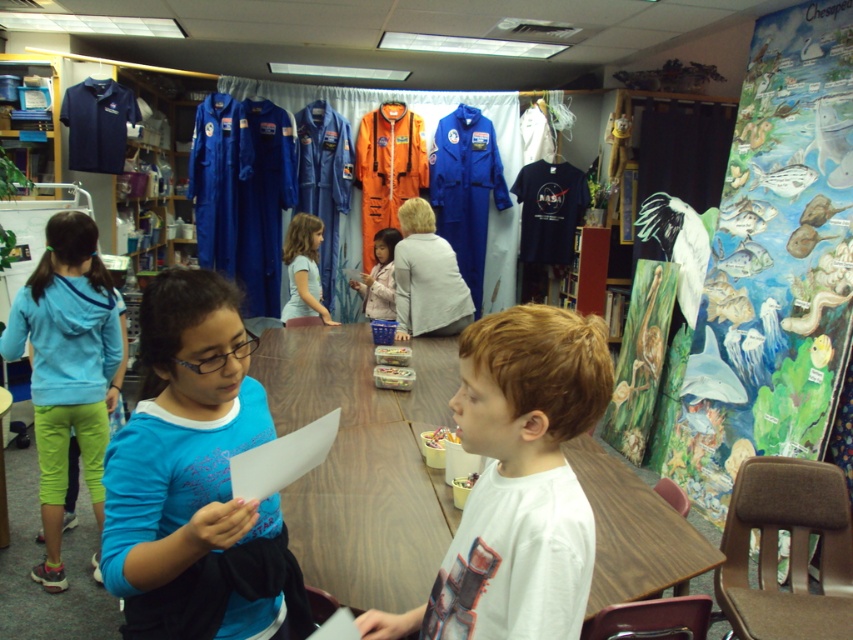
Is white matte shirt at center wider than light blue fleece jacket at lower left?

No, white matte shirt at center is not wider than light blue fleece jacket at lower left.

Image resolution: width=853 pixels, height=640 pixels. Find the location of `white matte shirt at center`. white matte shirt at center is located at coordinates (518, 481).

The image size is (853, 640). In order to click on white matte shirt at center in this screenshot , I will do `click(518, 481)`.

Looking at this image, can you confirm if light blue fabric shirt at center is positioned below fluffy pink jacket at center?

Yes.

Between light blue fabric shirt at center and fluffy pink jacket at center, which one appears on the right side from the viewer's perspective?

fluffy pink jacket at center

Describe the element at coordinates (303, 268) in the screenshot. I see `light blue fabric shirt at center` at that location.

Identify the location of light blue fabric shirt at center. (303, 268).

Which is more to the right, white matte shirt at center or light blue fabric shirt at center?

white matte shirt at center is more to the right.

Who is more forward, (483,588) or (311,292)?

Point (483,588) is more forward.

The width and height of the screenshot is (853, 640). Identify the location of white matte shirt at center. (518, 481).